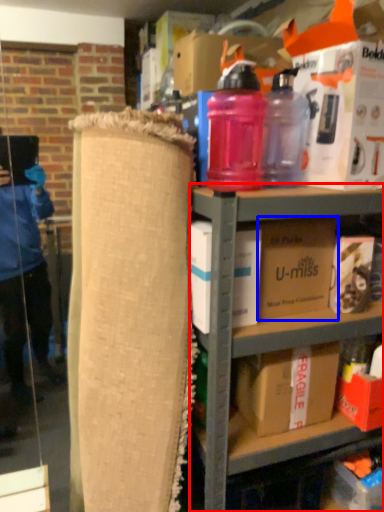
Question: Which point is closer to the camera, shelf (highlighted by a red box) or box (highlighted by a blue box)?

Choices:
 (A) shelf
 (B) box

Answer: (A)